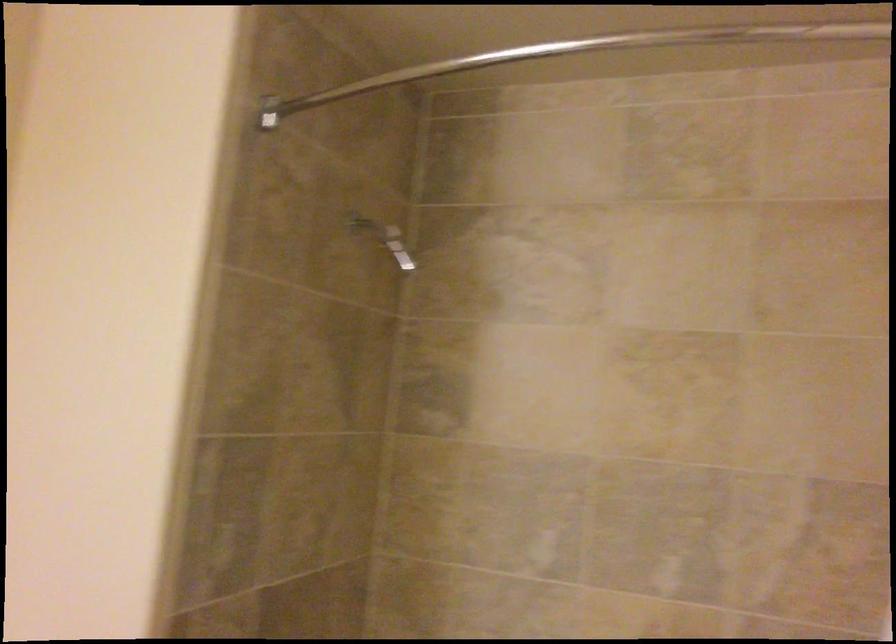
At what (x,y) coordinates should I click in order to perform the action: click on silver shower head lever. Please return your answer as a coordinate pair (x, y). This screenshot has width=896, height=644. Looking at the image, I should click on (384, 239).